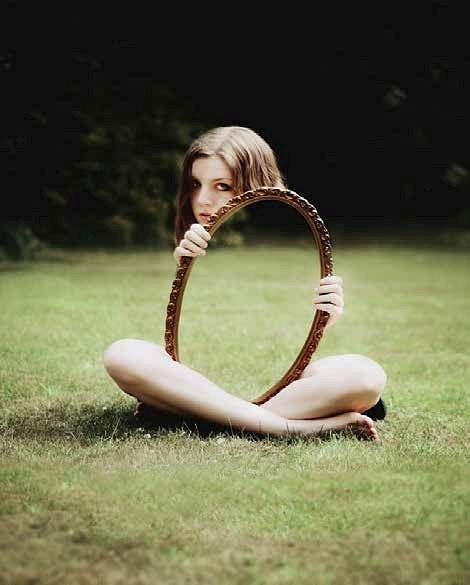
Find the location of `oval shaped mirror with golden frame`. oval shaped mirror with golden frame is located at coordinates (279, 312).